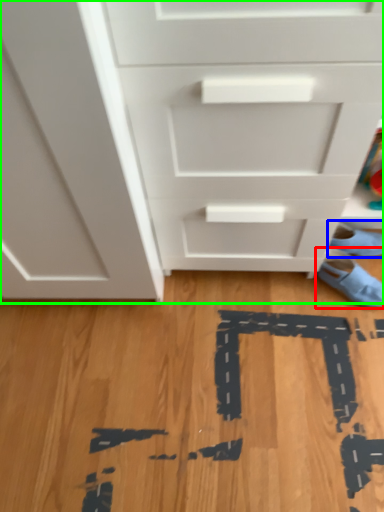
Question: Which is farther away from footwear (highlighted by a red box)? footwear (highlighted by a blue box) or chest of drawers (highlighted by a green box)?

Choices:
 (A) footwear
 (B) chest of drawers

Answer: (B)